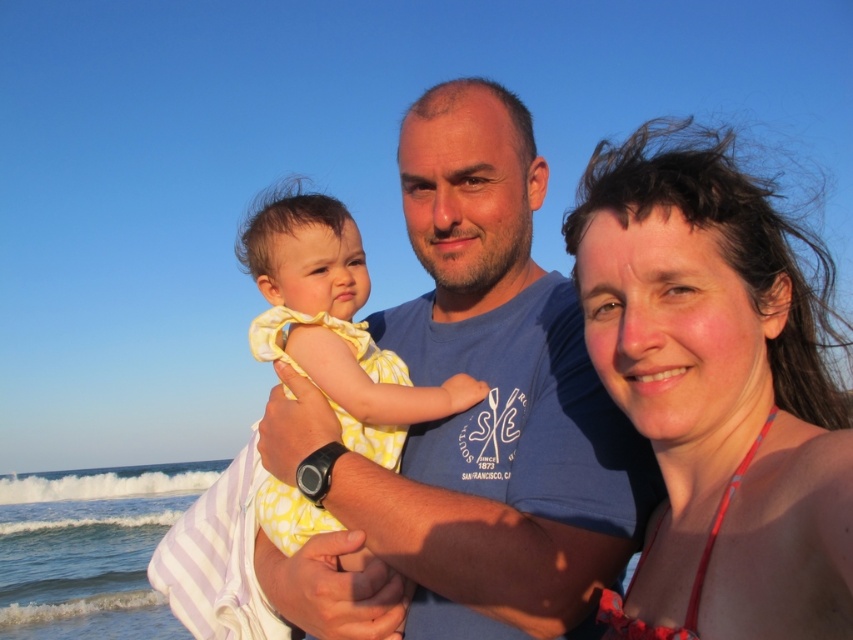
Question: Considering the relative positions of matte pink bikini top at center and yellow dotted dress at center in the image provided, where is matte pink bikini top at center located with respect to yellow dotted dress at center?

Choices:
 (A) above
 (B) below

Answer: (B)

Question: Which point is farther to the camera?

Choices:
 (A) (328, 390)
 (B) (485, 244)

Answer: (B)

Question: Does blue cotton shirt at center appear on the right side of matte pink bikini top at center?

Choices:
 (A) no
 (B) yes

Answer: (A)

Question: Considering the relative positions of blue cotton shirt at center and matte pink bikini top at center in the image provided, where is blue cotton shirt at center located with respect to matte pink bikini top at center?

Choices:
 (A) left
 (B) right

Answer: (A)

Question: Which object appears closest to the camera in this image?

Choices:
 (A) matte pink bikini top at center
 (B) yellow dotted dress at center
 (C) blue cotton shirt at center

Answer: (A)

Question: Which object is closer to the camera taking this photo?

Choices:
 (A) blue cotton shirt at center
 (B) yellow dotted dress at center
 (C) matte pink bikini top at center

Answer: (C)